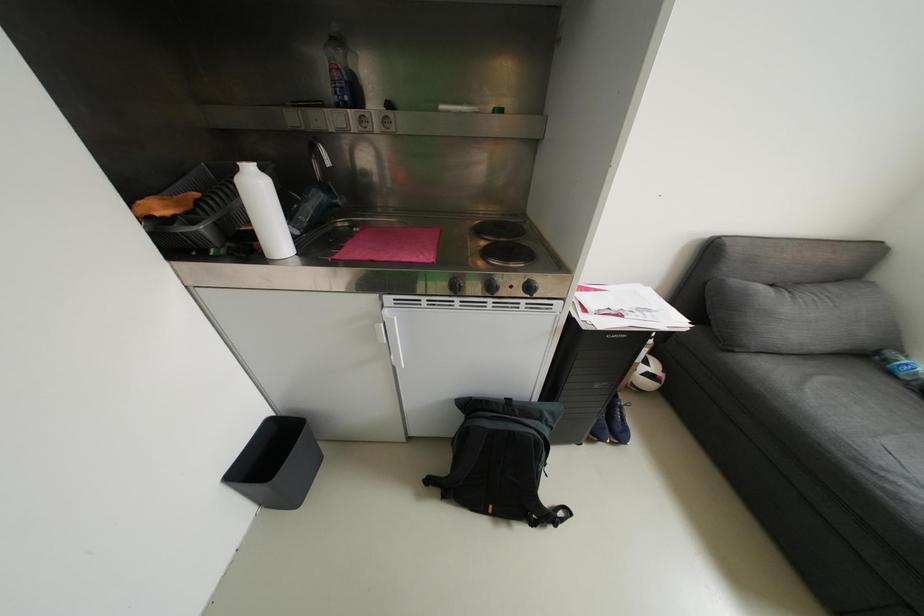
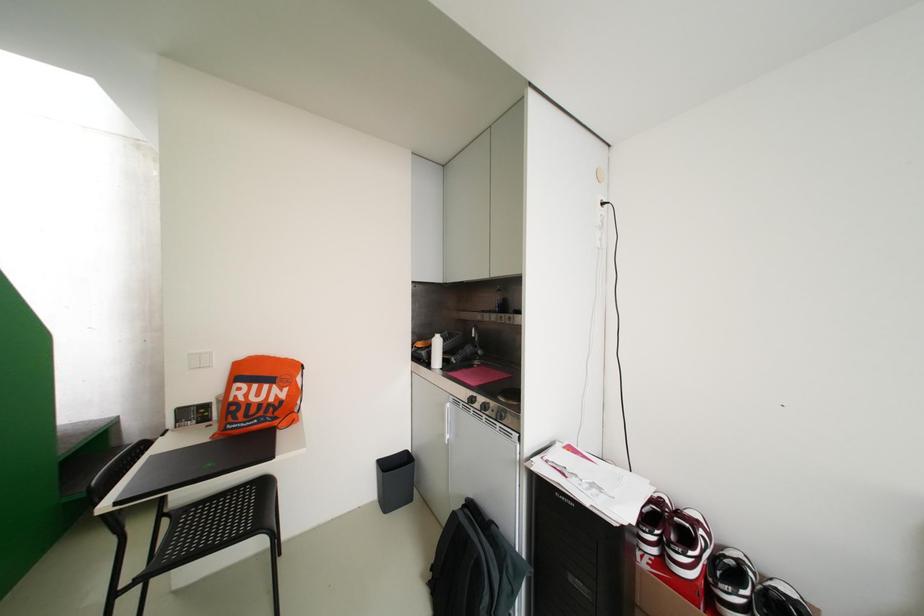
Based on the photo, based on the continuous images, in which direction is the camera rotating?

The camera rotated toward left-up.